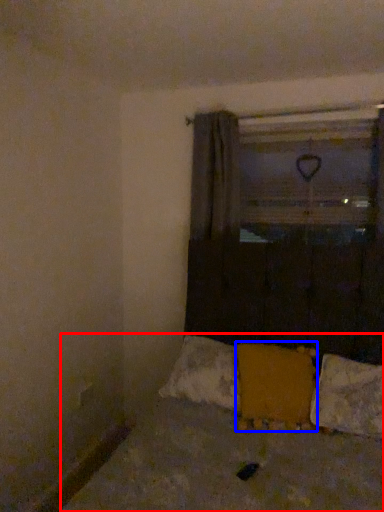
Question: Which object appears farthest to the camera in this image, bed (highlighted by a red box) or pillow (highlighted by a blue box)?

Choices:
 (A) bed
 (B) pillow

Answer: (B)